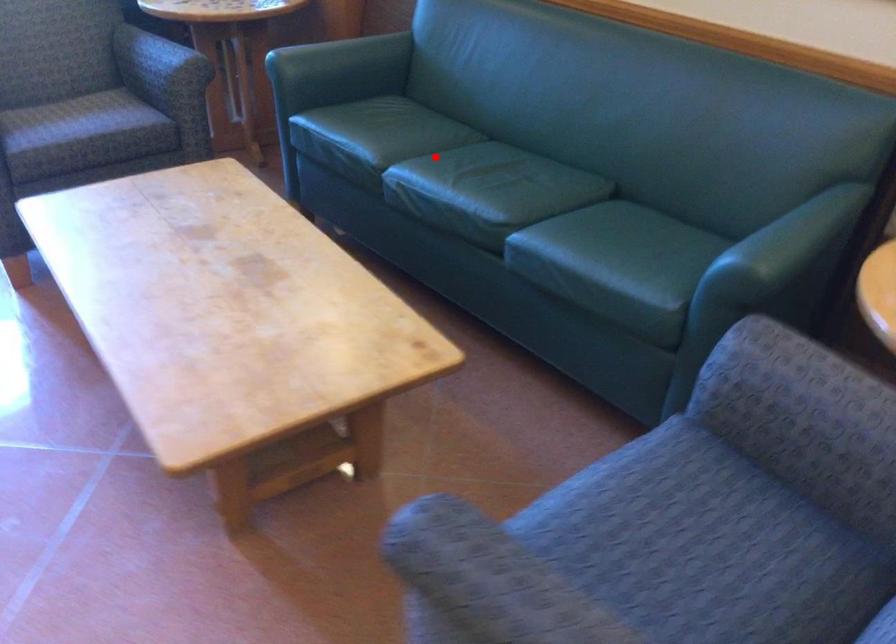
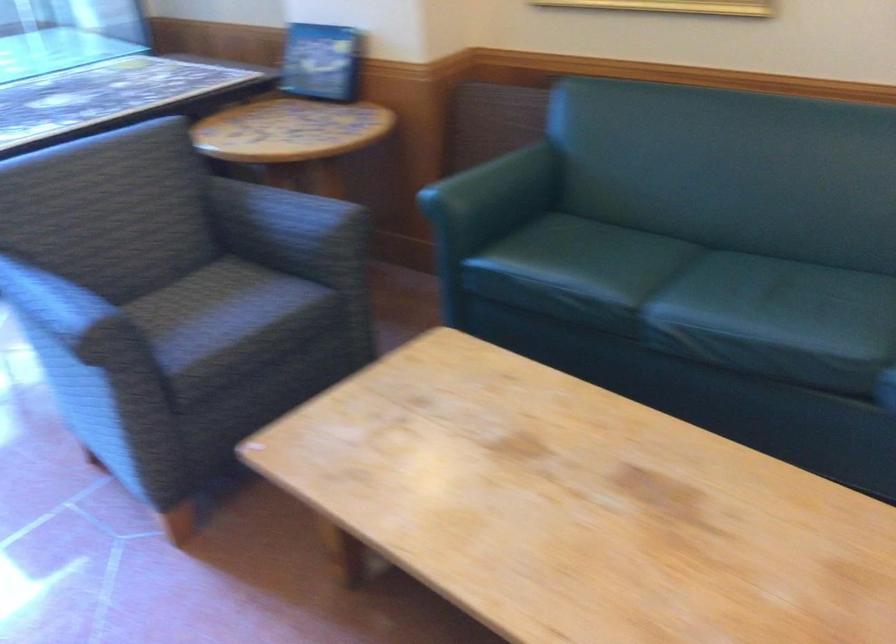
In the second image, find the point that corresponds to the highlighted location in the first image.

(679, 283)